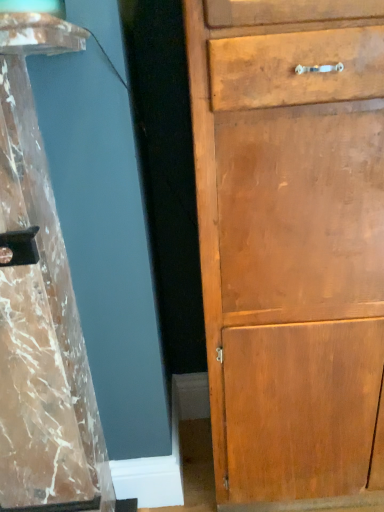
The height and width of the screenshot is (512, 384). What do you see at coordinates (291, 242) in the screenshot?
I see `wooden cabinet at right` at bounding box center [291, 242].

This screenshot has height=512, width=384. Find the location of `wooden cabinet at right`. wooden cabinet at right is located at coordinates (291, 242).

What do you see at coordinates (41, 305) in the screenshot?
I see `marble-like wood at left` at bounding box center [41, 305].

In order to face marble-like wood at left, should I rotate leftwards or rightwards?

Rotate left and turn 25.379 degrees.

Locate an element on the screen. This screenshot has height=512, width=384. marble-like wood at left is located at coordinates (41, 305).

I want to click on wooden cabinet at right, so point(291,242).

Is wooden cabinet at right at the right side of marble-like wood at left?

Indeed, wooden cabinet at right is positioned on the right side of marble-like wood at left.

In the image, is wooden cabinet at right positioned in front of or behind marble-like wood at left?

wooden cabinet at right is positioned farther from the viewer than marble-like wood at left.

Is point (342, 207) farther from viewer compared to point (26, 300)?

Yes, it is.

From the image's perspective, between wooden cabinet at right and marble-like wood at left, who is located below?

marble-like wood at left, from the image's perspective.

From a real-world perspective, which object rests below the other?

From a 3D spatial view, marble-like wood at left is below.

Considering the relative sizes of wooden cabinet at right and marble-like wood at left in the image provided, is wooden cabinet at right thinner than marble-like wood at left?

Correct, the width of wooden cabinet at right is less than that of marble-like wood at left.

Who is taller, wooden cabinet at right or marble-like wood at left?

wooden cabinet at right is taller.

Considering the sizes of objects wooden cabinet at right and marble-like wood at left in the image provided, who is bigger, wooden cabinet at right or marble-like wood at left?

Bigger between the two is wooden cabinet at right.

Is wooden cabinet at right completely or partially outside of marble-like wood at left?

Yes, wooden cabinet at right is located beyond the bounds of marble-like wood at left.

Would you say wooden cabinet at right is a long distance from marble-like wood at left?

No, wooden cabinet at right is not far from marble-like wood at left.

Does wooden cabinet at right turn towards marble-like wood at left?

No, wooden cabinet at right does not turn towards marble-like wood at left.

Image resolution: width=384 pixels, height=512 pixels. Identify the location of pillar beneath the wooden cabinet at right (from a real-world perspective). (41, 305).

Considering the positions of objects marble-like wood at left and wooden cabinet at right in the image provided, who is more to the left, marble-like wood at left or wooden cabinet at right?

marble-like wood at left is more to the left.

Which object is further away from the camera, marble-like wood at left or wooden cabinet at right?

wooden cabinet at right.

Considering the positions of points (51, 447) and (264, 55), is point (51, 447) farther from camera compared to point (264, 55)?

Yes, point (51, 447) is behind point (264, 55).

From the image's perspective, which one is positioned higher, marble-like wood at left or wooden cabinet at right?

wooden cabinet at right.

In the scene shown: From a real-world perspective, is marble-like wood at left positioned above or below wooden cabinet at right?

marble-like wood at left is below wooden cabinet at right.

Considering the relative sizes of marble-like wood at left and wooden cabinet at right in the image provided, is marble-like wood at left thinner than wooden cabinet at right?

In fact, marble-like wood at left might be wider than wooden cabinet at right.

Is marble-like wood at left shorter than wooden cabinet at right?

Yes, marble-like wood at left is shorter than wooden cabinet at right.

Is marble-like wood at left smaller than wooden cabinet at right?

Yes.

Is marble-like wood at left located outside wooden cabinet at right?

Yes, marble-like wood at left is outside of wooden cabinet at right.

From the picture: Is marble-like wood at left next to wooden cabinet at right and touching it?

No, marble-like wood at left is not beside wooden cabinet at right.

Is marble-like wood at left turned away from wooden cabinet at right?

No, marble-like wood at left is not facing away from wooden cabinet at right.

How distant is marble-like wood at left from wooden cabinet at right?

marble-like wood at left is 43.90 centimeters from wooden cabinet at right.

In the image, there is a marble-like wood at left. Identify the location of the chest of drawers above it (from the image's perspective). (291, 242).

The height and width of the screenshot is (512, 384). What are the coordinates of `chest of drawers on the right of marble-like wood at left` in the screenshot? It's located at 291,242.

At what (x,y) coordinates should I click in order to perform the action: click on pillar below the wooden cabinet at right (from a real-world perspective). Please return your answer as a coordinate pair (x, y). Looking at the image, I should click on coord(41,305).